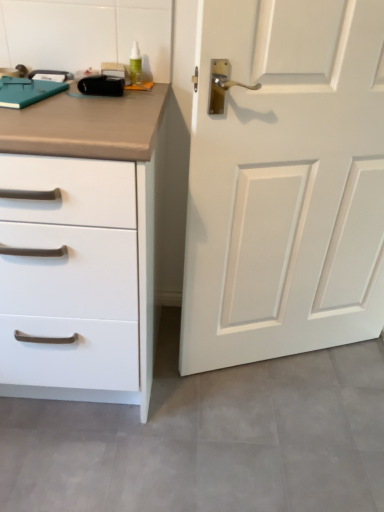
Question: Looking at their shapes, would you say white matte door at right is wider or thinner than white matte chest of drawers at left?

Choices:
 (A) thin
 (B) wide

Answer: (A)

Question: Is white matte door at right situated inside white matte chest of drawers at left or outside?

Choices:
 (A) inside
 (B) outside

Answer: (B)

Question: Is white matte door at right to the left or to the right of white matte chest of drawers at left in the image?

Choices:
 (A) left
 (B) right

Answer: (B)

Question: Is white matte chest of drawers at left bigger or smaller than white matte door at right?

Choices:
 (A) big
 (B) small

Answer: (A)

Question: Is point coord(107,362) positioned closer to the camera than point coord(264,50)?

Choices:
 (A) farther
 (B) closer

Answer: (A)

Question: From a real-world perspective, is white matte chest of drawers at left above or below white matte door at right?

Choices:
 (A) above
 (B) below

Answer: (B)

Question: Considering the positions of white matte chest of drawers at left and white matte door at right in the image, is white matte chest of drawers at left wider or thinner than white matte door at right?

Choices:
 (A) thin
 (B) wide

Answer: (B)